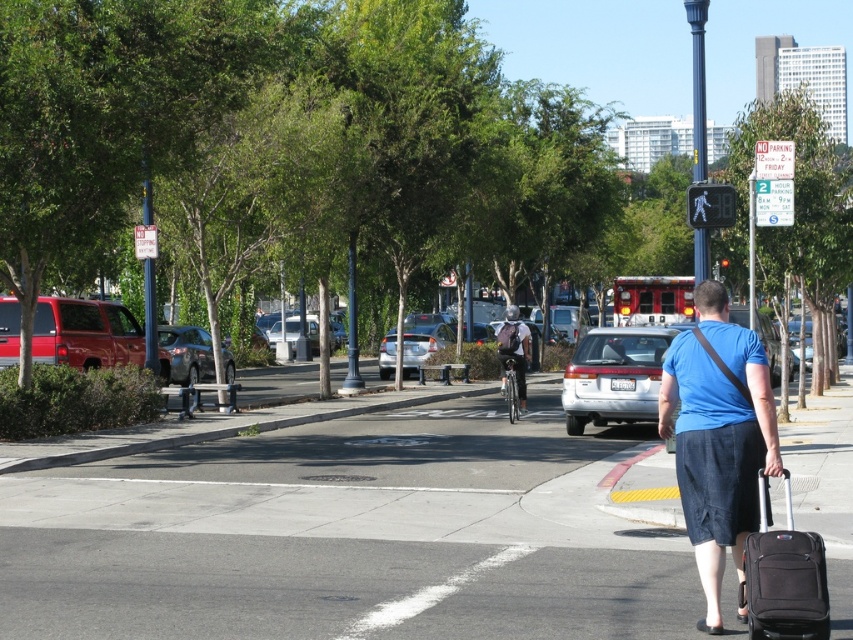
Question: Can you confirm if matte red suv at left is wider than matte black backpack at center?

Choices:
 (A) no
 (B) yes

Answer: (A)

Question: Is black fabric suitcase at lower right smaller than satin silver sedan at center?

Choices:
 (A) yes
 (B) no

Answer: (A)

Question: Which point appears farthest from the camera in this image?

Choices:
 (A) (112, 349)
 (B) (801, 577)
 (C) (405, 348)

Answer: (C)

Question: Which point is farther to the camera?

Choices:
 (A) matte red suv at left
 (B) blue denim shorts at lower right
 (C) matte black backpack at center
 (D) satin silver sedan at center

Answer: (D)

Question: Which object is positioned closest to the gray asphalt at center?

Choices:
 (A) black fabric suitcase at lower right
 (B) satin silver sedan at center

Answer: (A)

Question: Does gray asphalt at center lie in front of metallic gray sedan at left?

Choices:
 (A) no
 (B) yes

Answer: (B)